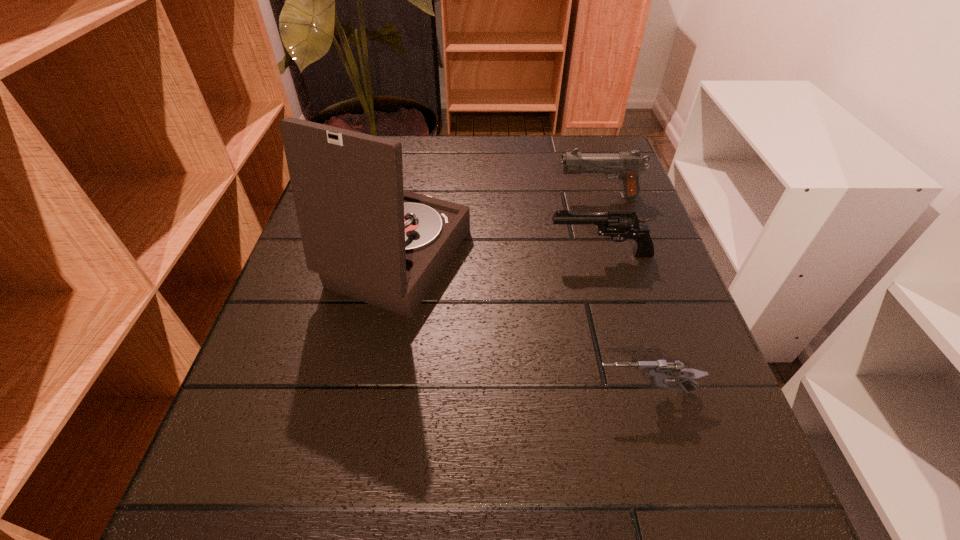
The image size is (960, 540). Identify the location of vacant space at the far right corner. (565, 185).

Where is `vacant space that's between the shortest gun and the farthest object`? vacant space that's between the shortest gun and the farthest object is located at coordinates (621, 294).

The height and width of the screenshot is (540, 960). Find the location of `free area in between the tallest object and the second nearest gun`. free area in between the tallest object and the second nearest gun is located at coordinates (499, 257).

I want to click on blank region between the shortest gun and the second nearest gun, so click(x=622, y=323).

This screenshot has height=540, width=960. In order to click on vacant region between the phonograph record and the second farthest gun in this screenshot , I will do `click(499, 257)`.

Image resolution: width=960 pixels, height=540 pixels. Identify the location of unoccupied area between the leftmost object and the farthest object. (499, 228).

The height and width of the screenshot is (540, 960). What are the coordinates of `vacant space that is in between the second farthest gun and the nearest gun` in the screenshot? It's located at (622, 323).

Locate an element on the screen. vacant space in between the farthest object and the nearest object is located at coordinates (621, 294).

Point out which object is positioned as the second nearest to the second farthest gun. Please provide its 2D coordinates. Your answer should be formatted as a tuple, i.e. [(x, y)], where the tuple contains the x and y coordinates of a point satisfying the conditions above.

[(627, 165)]

Identify which object is located as the nearest to the shortest object. Please provide its 2D coordinates. Your answer should be formatted as a tuple, i.e. [(x, y)], where the tuple contains the x and y coordinates of a point satisfying the conditions above.

[(367, 238)]